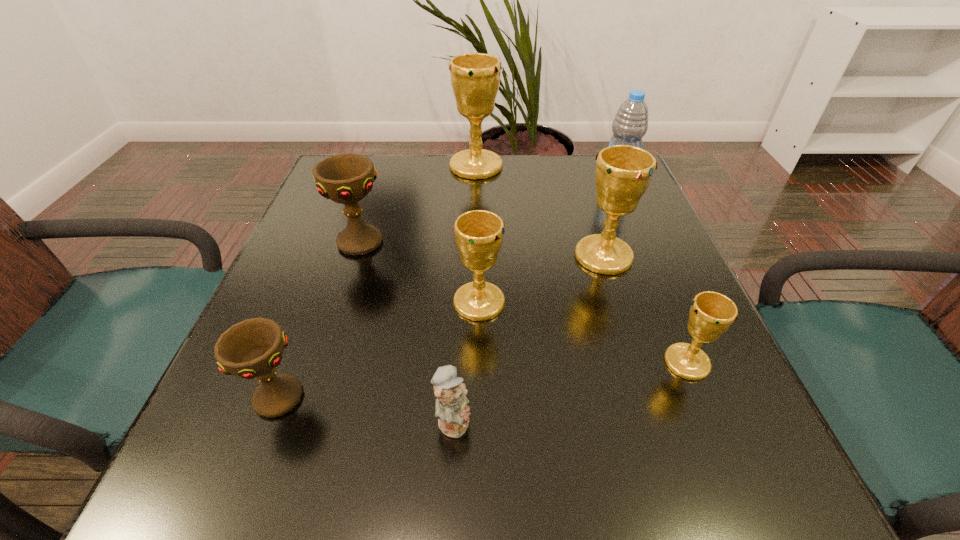
You are a GUI agent. You are given a task and a screenshot of the screen. Output one action in this format:
    pyautogui.click(x=<x>, y=<y>)
    Task: Click on the object that can be found as the seventh closest to the blue teddy bear
    
    Given the screenshot: What is the action you would take?
    pyautogui.click(x=630, y=124)

Locate an element on the screen. object that stands as the fourth closest to the bigger red chalice is located at coordinates (452, 411).

Locate which chalice is the second closest to the blue teddy bear. Please provide its 2D coordinates. Your answer should be formatted as a tuple, i.e. [(x, y)], where the tuple contains the x and y coordinates of a point satisfying the conditions above.

[(253, 348)]

Choose which chalice is the nearest neighbor to the nearer red chalice. Please provide its 2D coordinates. Your answer should be formatted as a tuple, i.e. [(x, y)], where the tuple contains the x and y coordinates of a point satisfying the conditions above.

[(479, 234)]

This screenshot has width=960, height=540. I want to click on the second closest gold chalice to the third farthest gold chalice, so click(711, 314).

Identify which gold chalice is the second closest to the blue water bottle. Please provide its 2D coordinates. Your answer should be formatted as a tuple, i.e. [(x, y)], where the tuple contains the x and y coordinates of a point satisfying the conditions above.

[(475, 77)]

At what (x,y) coordinates should I click in order to perform the action: click on free region that satisfies the following two spatial constraints: 1. on the front side of the nearest gold chalice; 2. on the right side of the bigger red chalice. Please return your answer as a coordinate pair (x, y). This screenshot has height=540, width=960. Looking at the image, I should click on (321, 362).

The width and height of the screenshot is (960, 540). Find the location of `free spot that satisfies the following two spatial constraints: 1. on the front side of the smallest gold chalice; 2. on the left side of the second farthest gold chalice`. free spot that satisfies the following two spatial constraints: 1. on the front side of the smallest gold chalice; 2. on the left side of the second farthest gold chalice is located at coordinates (637, 362).

Image resolution: width=960 pixels, height=540 pixels. Identify the location of blank area in the image that satisfies the following two spatial constraints: 1. on the back side of the farther red chalice; 2. on the right side of the biggest gold chalice. (383, 166).